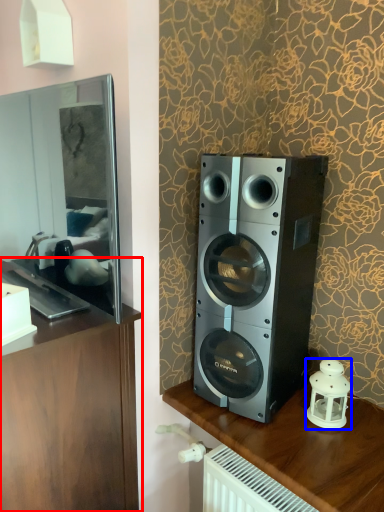
Question: Which object appears farthest to the camera in this image, furniture (highlighted by a red box) or candle holder (highlighted by a blue box)?

Choices:
 (A) furniture
 (B) candle holder

Answer: (B)